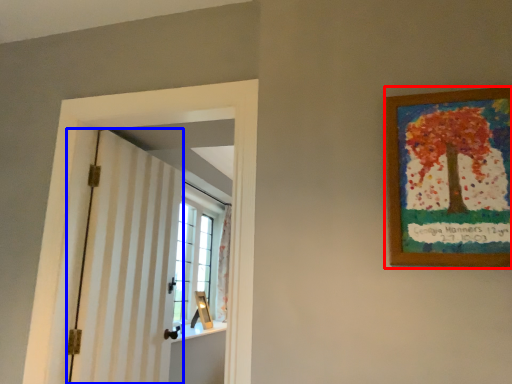
Question: Which object appears farthest to the camera in this image, picture frame (highlighted by a red box) or barn door (highlighted by a blue box)?

Choices:
 (A) picture frame
 (B) barn door

Answer: (B)